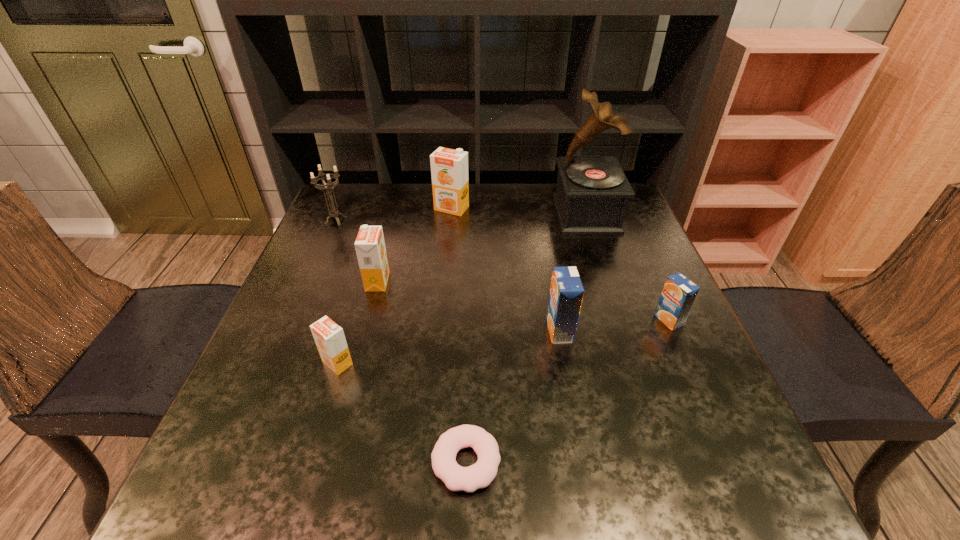
In order to click on free space located on the back of the bigger blue orange_juice in this screenshot , I will do `click(553, 295)`.

The height and width of the screenshot is (540, 960). In order to click on free space located 0.350m on the back of the right blue orange_juice in this screenshot , I will do `click(625, 220)`.

Locate an element on the screen. The height and width of the screenshot is (540, 960). vacant space located on the right of the nearest orange orange juice is located at coordinates 399,363.

Where is `vacant space located 0.260m on the left of the shortest object`? The height and width of the screenshot is (540, 960). vacant space located 0.260m on the left of the shortest object is located at coordinates (270, 462).

Image resolution: width=960 pixels, height=540 pixels. In order to click on phonograph_record that is positioned at the far edge in this screenshot , I will do `click(592, 192)`.

Image resolution: width=960 pixels, height=540 pixels. In order to click on orange juice at the far edge in this screenshot , I will do `click(449, 168)`.

What are the coordinates of `candle holder that is at the far edge` in the screenshot? It's located at (334, 213).

What are the coordinates of `object located in the near edge section of the desktop` in the screenshot? It's located at tap(479, 475).

I want to click on candle holder positioned at the left edge, so click(334, 213).

Locate an element on the screen. orange juice situated at the left edge is located at coordinates (329, 337).